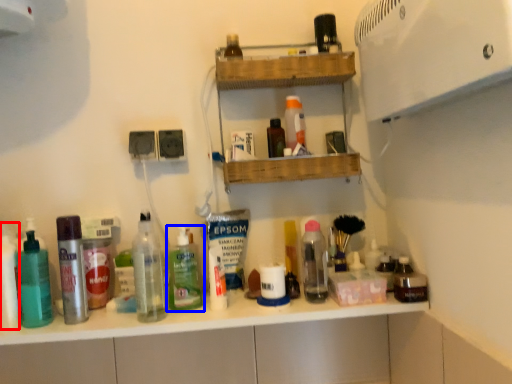
Question: Among these objects, which one is farthest to the camera, toiletry (highlighted by a red box) or bottle (highlighted by a blue box)?

Choices:
 (A) toiletry
 (B) bottle

Answer: (B)